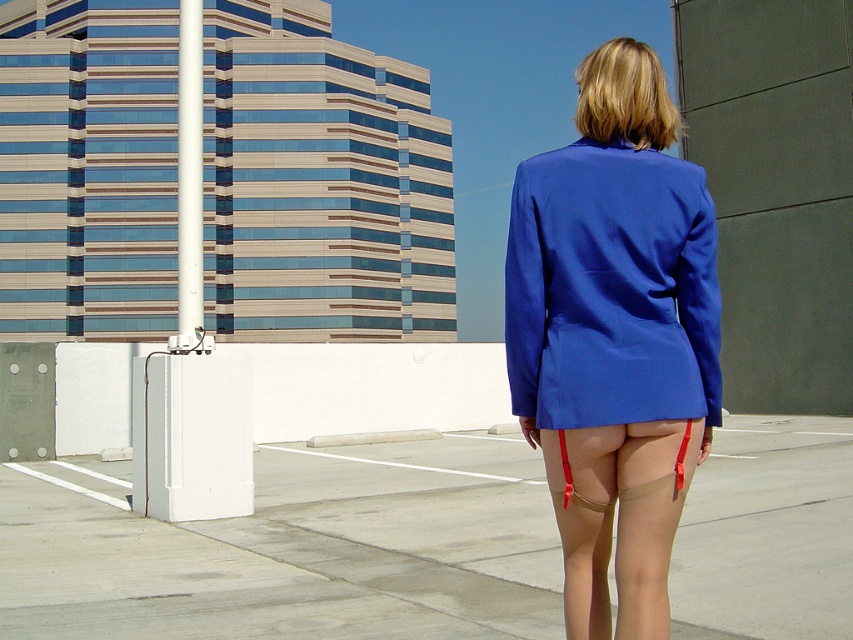
Question: Which of the following is the farthest from the observer?

Choices:
 (A) blue smooth blazer at center
 (B) matte blue blazer at center
 (C) concrete at center

Answer: (C)

Question: Observing the image, what is the correct spatial positioning of blue smooth blazer at center in reference to matte blue blazer at center?

Choices:
 (A) below
 (B) above

Answer: (A)

Question: Among these points, which one is nearest to the camera?

Choices:
 (A) (682, 248)
 (B) (126, 532)
 (C) (523, 355)

Answer: (A)

Question: Among these points, which one is nearest to the camera?

Choices:
 (A) (525, 289)
 (B) (42, 582)

Answer: (A)

Question: Is concrete at center below blue smooth blazer at center?

Choices:
 (A) yes
 (B) no

Answer: (A)

Question: Is blue smooth blazer at center behind matte blue blazer at center?

Choices:
 (A) no
 (B) yes

Answer: (A)